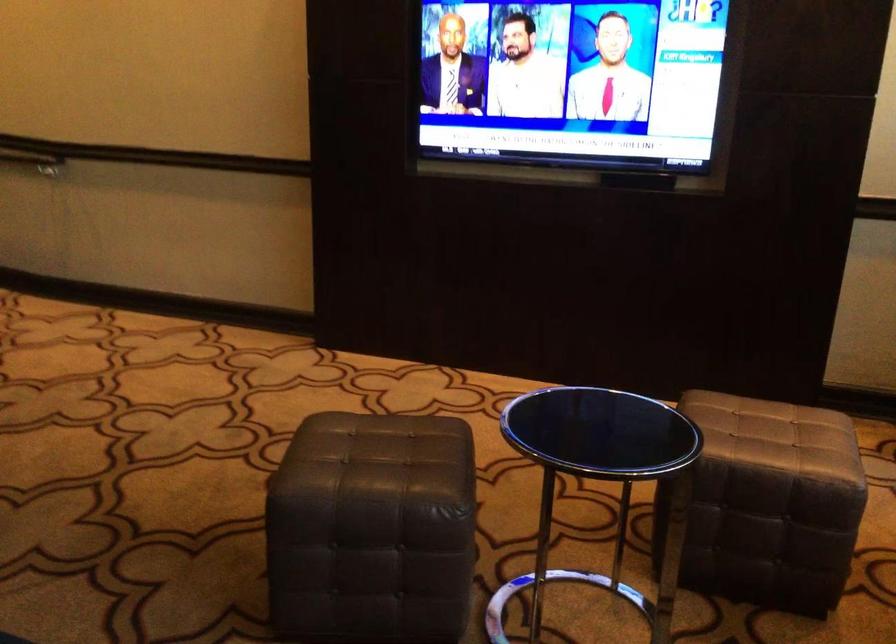
Locate an element on the screen. black wall handrail is located at coordinates (32, 160).